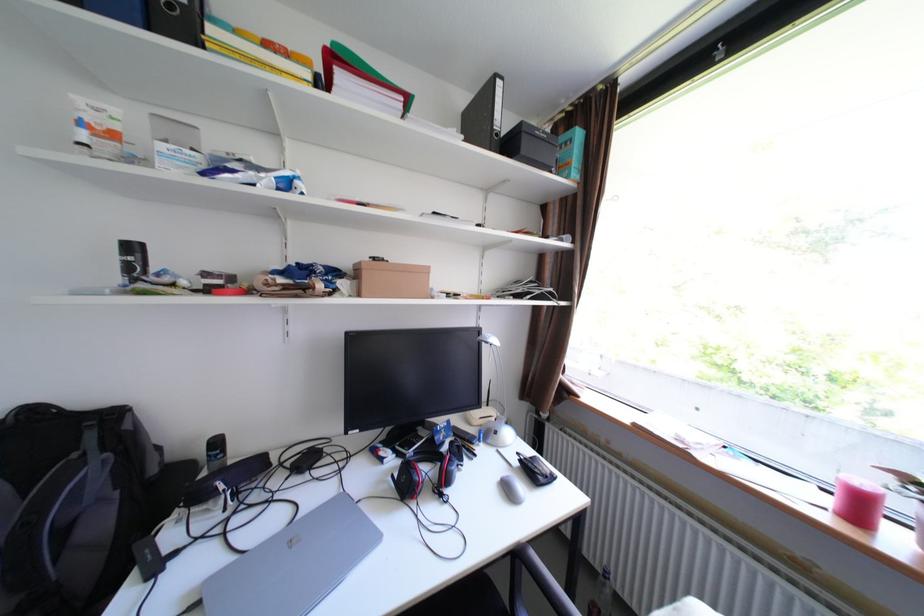
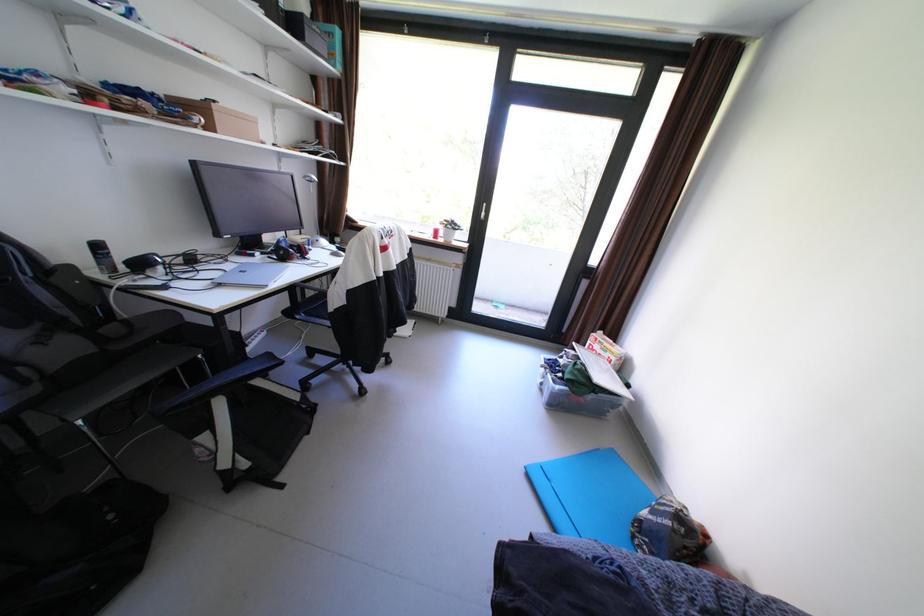
Find the pixel in the second image that matches the point at 324,272 in the first image.

(172, 100)